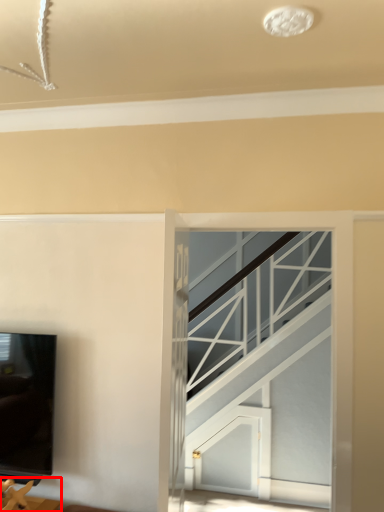
Question: From the image's perspective, where is furniture (annotated by the red box) located relative to glass door?

Choices:
 (A) above
 (B) below

Answer: (B)